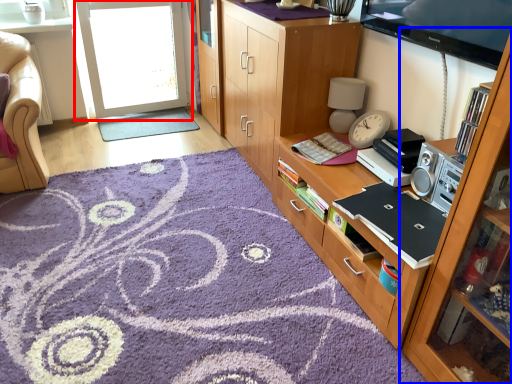
Question: Which of the following is the farthest to the observer, screen door (highlighted by a red box) or cabinetry (highlighted by a blue box)?

Choices:
 (A) screen door
 (B) cabinetry

Answer: (A)